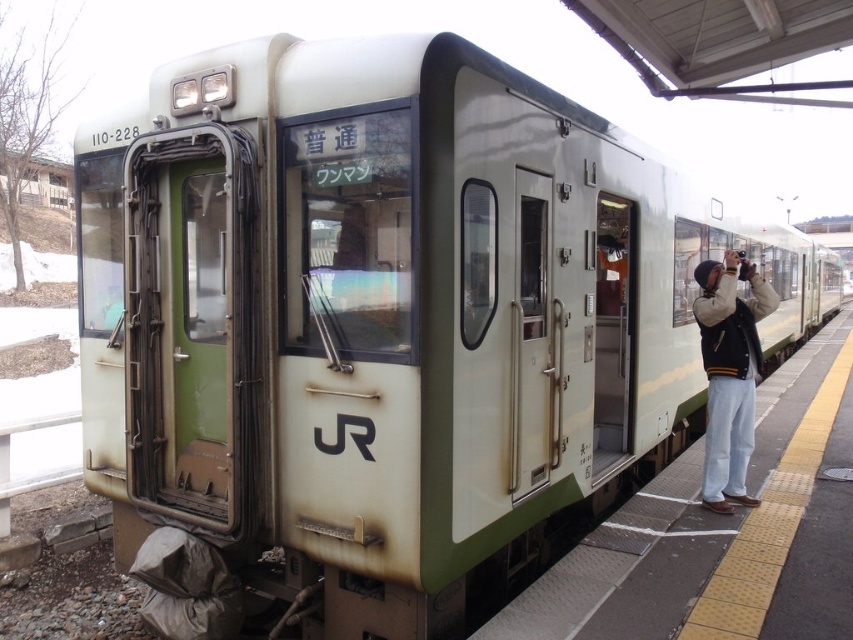
You are a luggage cart operator who needs to move a cart that is 1.5 meters wide from the smooth concrete platform at right to the khaki wool jacket at right. Can you fit the cart through the space between them?

The distance between the smooth concrete platform at right and the khaki wool jacket at right is 1.41 meters, which is narrower than the 1.5 meters width of the cart. Therefore, the cart cannot fit through the space between them.

You are standing on the platform and want to board the train through the open door. The khaki wool jacket at right is blocking your path. Can you step over the smooth concrete platform at right to bypass the jacket?

The smooth concrete platform at right is shorter than the khaki wool jacket at right, so you can step over the smooth concrete platform at right to bypass the jacket since it is lower than the jacket.